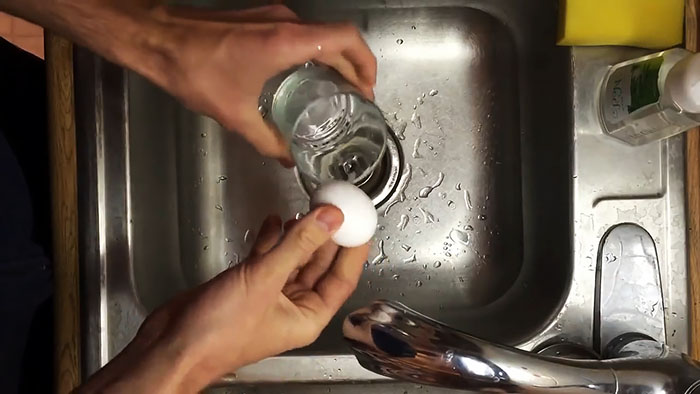
Where is `faucet`? faucet is located at coordinates (469, 344).